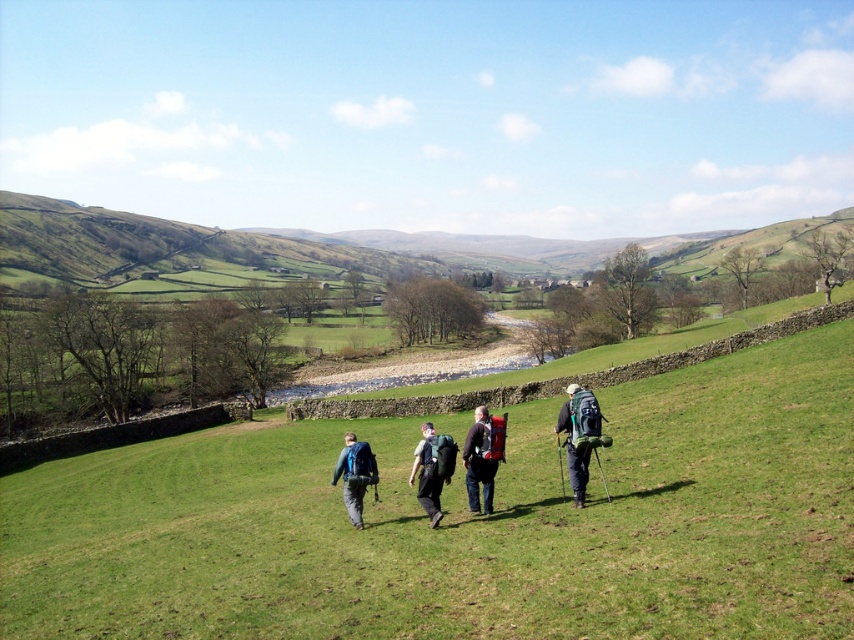
Who is positioned more to the right, matte black backpack at center or green fabric backpack at center?

From the viewer's perspective, matte black backpack at center appears more on the right side.

Consider the image. Does matte black backpack at center appear on the left side of green fabric backpack at center?

No, matte black backpack at center is not to the left of green fabric backpack at center.

Locate an element on the screen. matte black backpack at center is located at coordinates (483, 458).

Which of these two, matte black backpack at center or matte blue backpack at center, stands taller?

With more height is matte blue backpack at center.

Can you confirm if matte black backpack at center is thinner than matte blue backpack at center?

Yes, matte black backpack at center is thinner than matte blue backpack at center.

At what (x,y) coordinates should I click in order to perform the action: click on matte black backpack at center. Please return your answer as a coordinate pair (x, y). This screenshot has height=640, width=854. Looking at the image, I should click on coord(483,458).

I want to click on matte black backpack at center, so click(x=483, y=458).

How much distance is there between matte green backpack at center and matte black backpack at center?

matte green backpack at center and matte black backpack at center are 3.05 meters apart.

Does matte green backpack at center appear on the left side of matte black backpack at center?

No, matte green backpack at center is not to the left of matte black backpack at center.

The image size is (854, 640). Find the location of `matte green backpack at center`. matte green backpack at center is located at coordinates (578, 435).

Image resolution: width=854 pixels, height=640 pixels. Identify the location of matte green backpack at center. (578, 435).